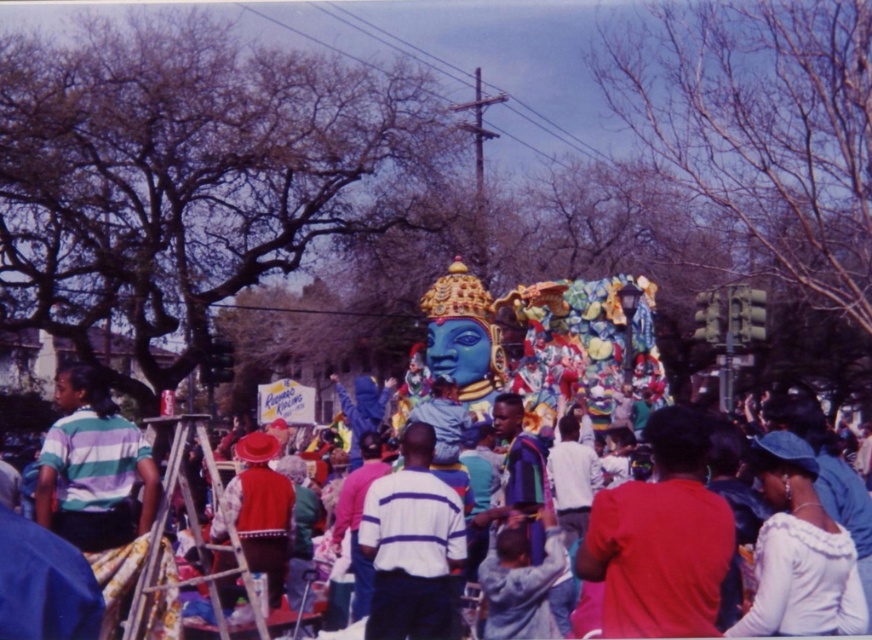
You are a photographer trying to capture the float with the blue face and golden crown in the center of your image. There is a wooden ladder at left in the scene. Based on its position, would the ladder be visible in your photo if you frame the shot to focus on the float?

The wooden ladder at left is positioned at point (189, 529), which is likely outside the central framing required to capture the float with the blue face and golden crown. Therefore, the ladder would not be visible in the photo if you frame the shot to focus on the float.

You are a photographer at the festival. You want to take a photo of the red velvet hat at center without the white satin hat at upper right blocking it. Is this possible?

The white satin hat at upper right is in front of the red velvet hat at center, so it would block the view. To capture the red velvet hat at center without obstruction, you need to reposition yourself or the hats so that the white satin hat at upper right is no longer in front.

You are a photographer at the festival trying to capture the shiny metallic float at center and the white satin hat at upper right in the same frame. Based on their positions, can you determine which object is closer to the camera?

The white satin hat at upper right is located below the shiny metallic float at center, which means the hat is closer to the camera than the float.